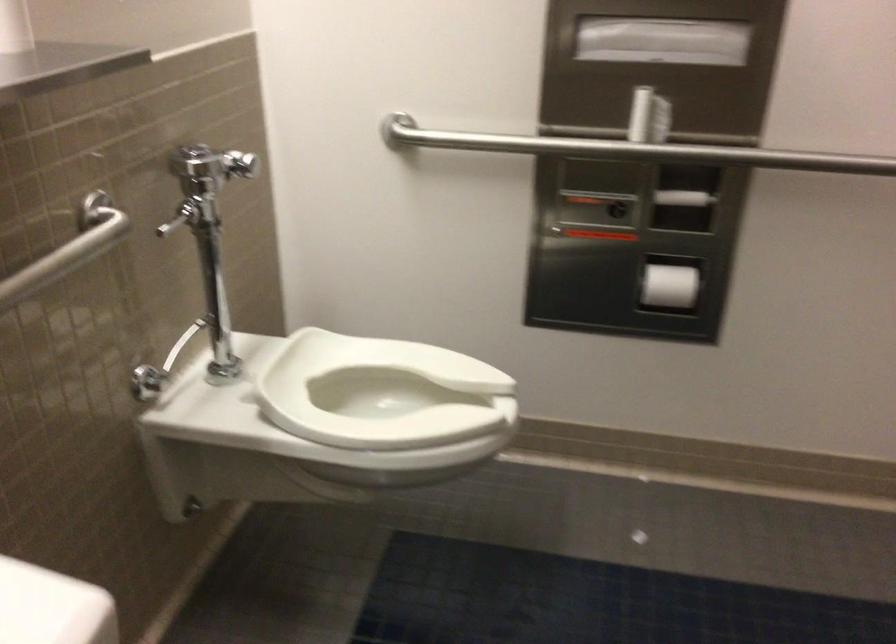
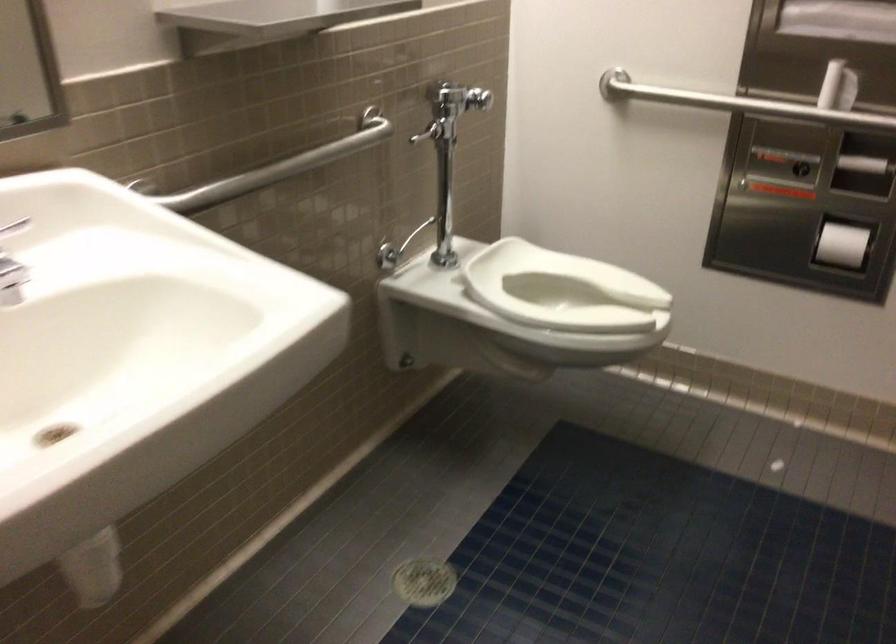
Question: How did the camera likely rotate?

Choices:
 (A) Left
 (B) Right
 (C) Up
 (D) Down

Answer: (A)